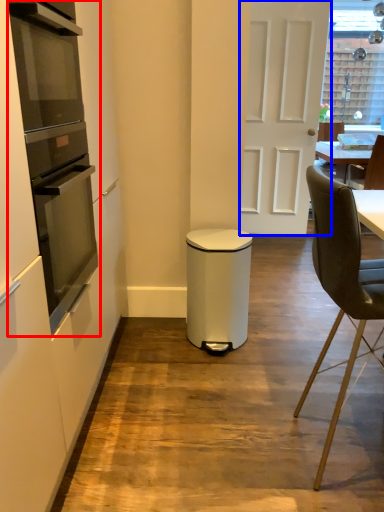
Question: Among these objects, which one is farthest to the camera, kitchen appliance (highlighted by a red box) or door (highlighted by a blue box)?

Choices:
 (A) kitchen appliance
 (B) door

Answer: (B)